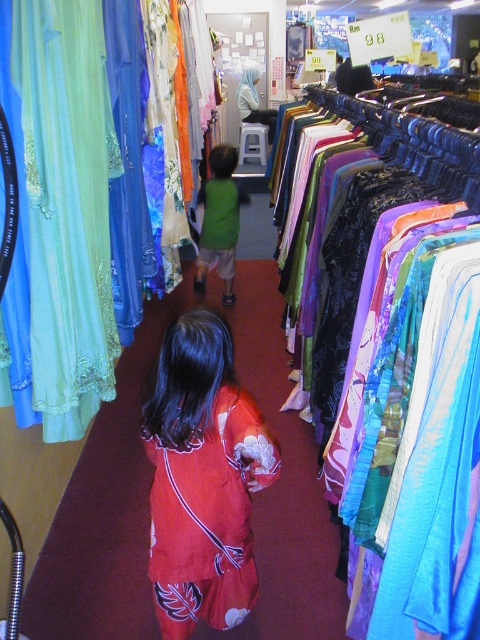
Who is lower down, red satin blouse at center or green matte shirt at center?

red satin blouse at center is below.

Which is more to the right, red satin blouse at center or green matte shirt at center?

Positioned to the right is red satin blouse at center.

The image size is (480, 640). Find the location of `red satin blouse at center`. red satin blouse at center is located at coordinates (207, 516).

Between point (439, 164) and point (229, 216), which one is positioned behind?

The point (229, 216) is behind.

Which is above, shiny blue fabric at right or green matte shirt at center?

green matte shirt at center is above.

This screenshot has width=480, height=640. Describe the element at coordinates (408, 144) in the screenshot. I see `shiny blue fabric at right` at that location.

Image resolution: width=480 pixels, height=640 pixels. I want to click on shiny blue fabric at right, so click(408, 144).

Does red satin blouse at center have a smaller size compared to shiny blue fabric at right?

Yes, red satin blouse at center is smaller than shiny blue fabric at right.

Which is above, red satin blouse at center or shiny blue fabric at right?

Positioned higher is shiny blue fabric at right.

This screenshot has height=640, width=480. What do you see at coordinates (207, 516) in the screenshot?
I see `red satin blouse at center` at bounding box center [207, 516].

Find the location of `red satin blouse at center`. red satin blouse at center is located at coordinates (207, 516).